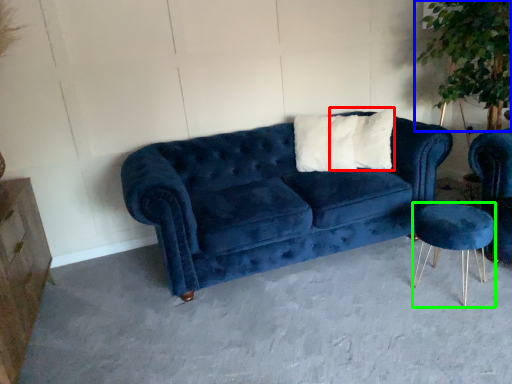
Question: Estimate the real-world distances between objects in this image. Which object is closer to pillow (highlighted by a red box), plant (highlighted by a blue box) or bar stool (highlighted by a green box)?

Choices:
 (A) plant
 (B) bar stool

Answer: (A)